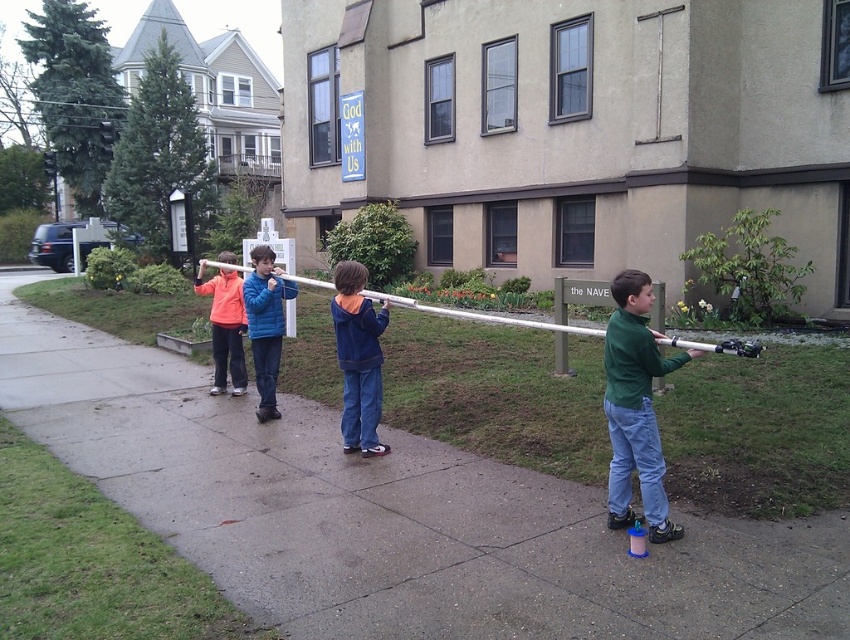
Does green matte shirt at right have a greater width compared to orange fleece jacket at left?

Incorrect, green matte shirt at right's width does not surpass orange fleece jacket at left's.

In the scene shown: Does green matte shirt at right have a lesser height compared to orange fleece jacket at left?

Correct, green matte shirt at right is not as tall as orange fleece jacket at left.

Locate an element on the screen. green matte shirt at right is located at coordinates (635, 406).

I want to click on concrete at center, so [392, 515].

Where is `concrete at center`? concrete at center is located at coordinates (392, 515).

Who is positioned more to the right, navy blue hoodie at center or orange fleece jacket at left?

navy blue hoodie at center

Is point (370, 300) farther from camera compared to point (197, 275)?

No, it is in front of (197, 275).

You are a GUI agent. You are given a task and a screenshot of the screen. Output one action in this format:
    pyautogui.click(x=<x>, y=<y>)
    Task: Click on the navy blue hoodie at center
    
    Given the screenshot: What is the action you would take?
    358,358

Identify the location of navy blue hoodie at center. (358, 358).